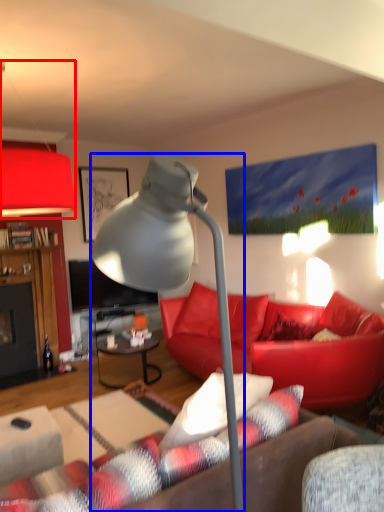
Question: Which point is closer to the camera, lamp (highlighted by a red box) or lamp (highlighted by a blue box)?

Choices:
 (A) lamp
 (B) lamp

Answer: (B)